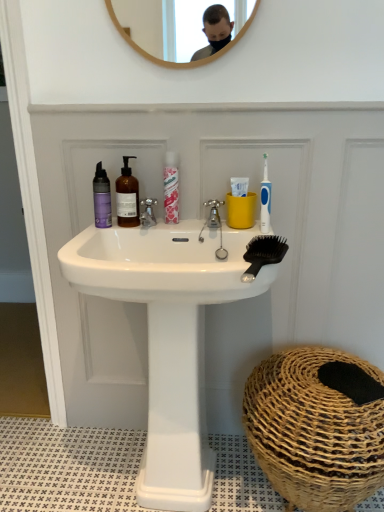
Locate an element on the screen. The image size is (384, 512). free space to the left of white glossy sink at center is located at coordinates (52, 461).